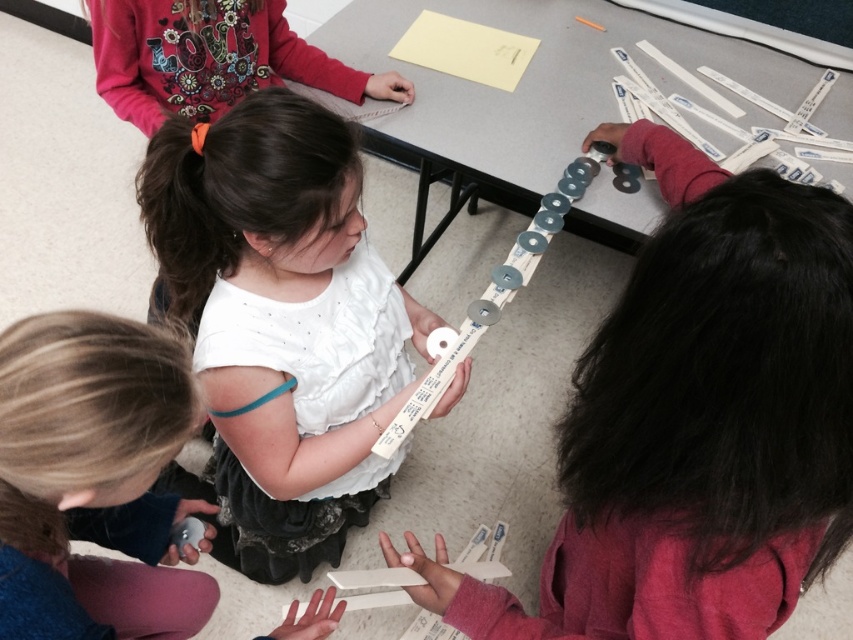
Question: Considering the real-world distances, which object is closest to the white paper at center?

Choices:
 (A) white matte shirt at center
 (B) white matte paper strip at upper center

Answer: (B)

Question: Can you confirm if white matte paper strip at upper center is positioned to the right of white matte tape measure at center?

Choices:
 (A) no
 (B) yes

Answer: (B)

Question: Can you confirm if white matte shirt at center is wider than white paper at center?

Choices:
 (A) yes
 (B) no

Answer: (B)

Question: Can you confirm if white matte tape measure at center is positioned to the left of white matte shirt at center?

Choices:
 (A) yes
 (B) no

Answer: (B)

Question: Considering the real-world distances, which object is closest to the white matte paper strip at upper center?

Choices:
 (A) white paper at center
 (B) white matte shirt at center

Answer: (B)

Question: Estimate the real-world distances between objects in this image. Which object is closer to the white matte tape measure at center?

Choices:
 (A) white matte shirt at center
 (B) white paper at center
 (C) white matte paper strip at upper center

Answer: (A)